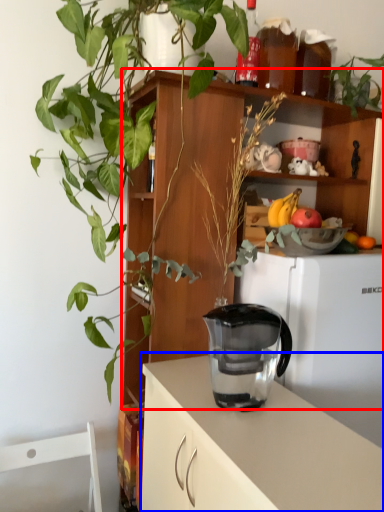
Question: Which of the following is the farthest to the observer, shelf (highlighted by a red box) or cabinetry (highlighted by a blue box)?

Choices:
 (A) shelf
 (B) cabinetry

Answer: (A)